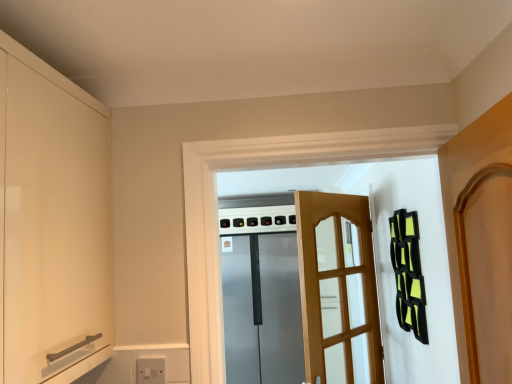
Question: From a real-world perspective, is matte white cabinet at left beneath light brown wooden screen door at center, which is the second screen door from back to front?

Choices:
 (A) yes
 (B) no

Answer: (B)

Question: Considering the relative sizes of matte white cabinet at left and light brown wooden screen door at center, which is the second screen door from back to front, in the image provided, is matte white cabinet at left bigger than light brown wooden screen door at center, which is the second screen door from back to front,?

Choices:
 (A) no
 (B) yes

Answer: (B)

Question: Is matte white cabinet at left at the left side of light brown wooden screen door at center, which is the second screen door from back to front?

Choices:
 (A) no
 (B) yes

Answer: (B)

Question: Is matte white cabinet at left at the right side of light brown wooden screen door at center, which is the second screen door from back to front?

Choices:
 (A) no
 (B) yes

Answer: (A)

Question: Would you consider matte white cabinet at left to be distant from light brown wooden screen door at center, which is counted as the 1th screen door, starting from the front?

Choices:
 (A) no
 (B) yes

Answer: (B)

Question: Visually, is satin silver refrigerator at center, the 2th screen door viewed from the front, positioned to the left or to the right of matte white cabinet at left?

Choices:
 (A) right
 (B) left

Answer: (A)

Question: Do you think satin silver refrigerator at center, the 2th screen door viewed from the front, is within matte white cabinet at left, or outside of it?

Choices:
 (A) inside
 (B) outside

Answer: (B)

Question: Relative to matte white cabinet at left, is satin silver refrigerator at center, marked as the 1th screen door in a back-to-front arrangement, in front or behind?

Choices:
 (A) front
 (B) behind

Answer: (B)

Question: Is satin silver refrigerator at center, the 2th screen door viewed from the front, taller or shorter than matte white cabinet at left?

Choices:
 (A) short
 (B) tall

Answer: (B)

Question: Would you say satin silver refrigerator at center, the 2th screen door viewed from the front, is inside or outside light brown wooden screen door at center, which is the second screen door from back to front?

Choices:
 (A) outside
 (B) inside

Answer: (A)

Question: Looking at the image, does satin silver refrigerator at center, the 2th screen door viewed from the front, seem bigger or smaller compared to light brown wooden screen door at center, which is the second screen door from back to front?

Choices:
 (A) small
 (B) big

Answer: (B)

Question: Looking at their shapes, would you say satin silver refrigerator at center, the 2th screen door viewed from the front, is wider or thinner than light brown wooden screen door at center, which is the second screen door from back to front?

Choices:
 (A) thin
 (B) wide

Answer: (B)

Question: From a real-world perspective, is satin silver refrigerator at center, marked as the 1th screen door in a back-to-front arrangement, physically located above or below light brown wooden screen door at center, which is counted as the 1th screen door, starting from the front?

Choices:
 (A) above
 (B) below

Answer: (B)

Question: In terms of height, does light brown wooden screen door at center, which is counted as the 1th screen door, starting from the front, look taller or shorter compared to matte white cabinet at left?

Choices:
 (A) tall
 (B) short

Answer: (A)

Question: From a real-world perspective, is light brown wooden screen door at center, which is counted as the 1th screen door, starting from the front, physically located above or below matte white cabinet at left?

Choices:
 (A) below
 (B) above

Answer: (A)